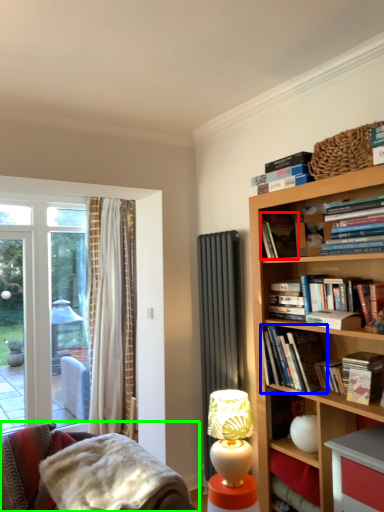
Question: Which object is the closest to the book (highlighted by a red box)? Choose among these: book (highlighted by a blue box) or studio couch (highlighted by a green box).

Choices:
 (A) book
 (B) studio couch

Answer: (A)